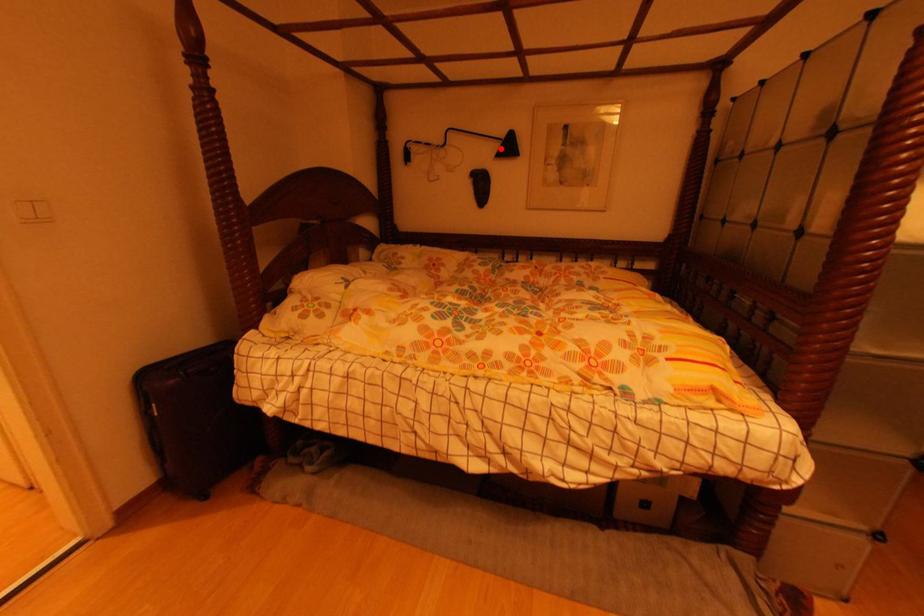
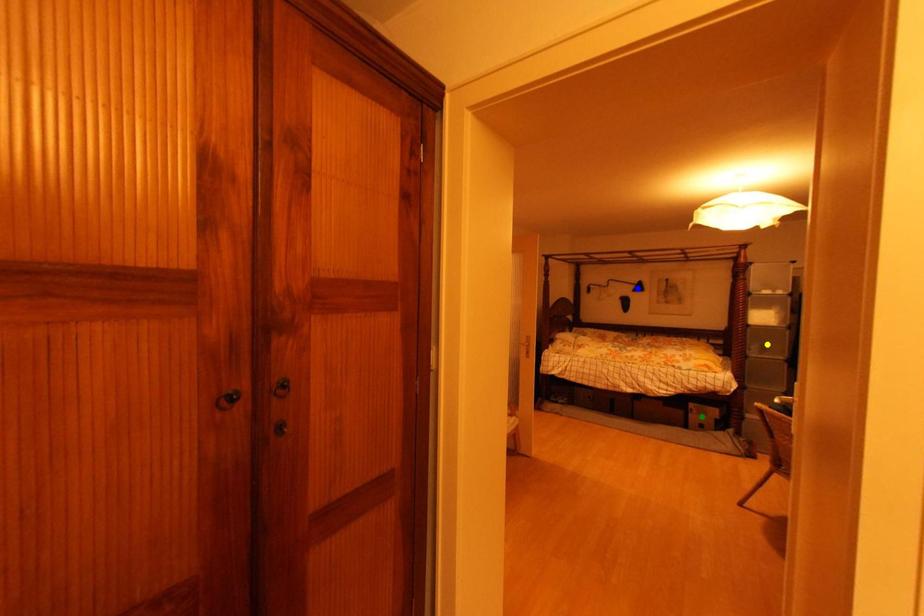
Question: I am providing you with two images of the same scene from different viewpoints. A red point is marked on the first image. You are given multiple points on the second image. In image 2, which mark is for the same physical point as the one in image 1?

Choices:
 (A) green point
 (B) yellow point
 (C) blue point

Answer: (C)